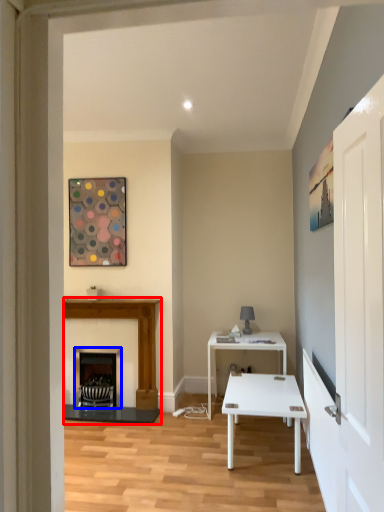
Question: Which object appears closest to the camera in this image, fireplace (highlighted by a red box) or fireplace (highlighted by a blue box)?

Choices:
 (A) fireplace
 (B) fireplace

Answer: (A)